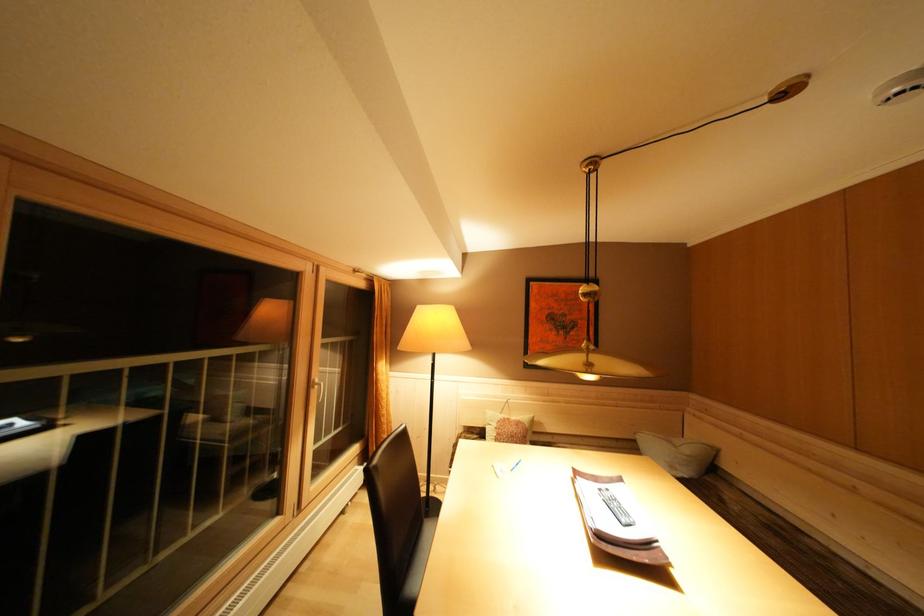
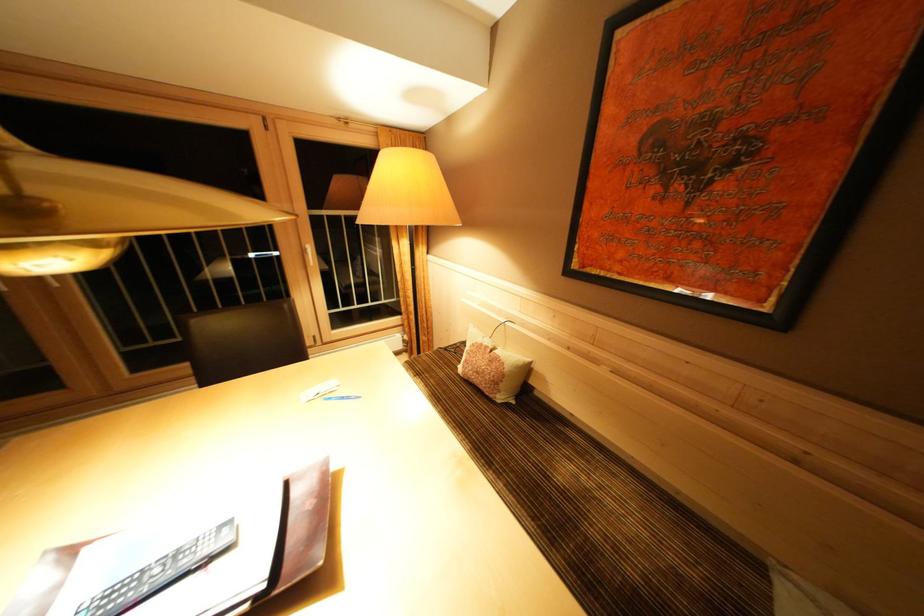
The point at (x=515, y=424) is marked in the first image. Where is the corresponding point in the second image?

(493, 352)